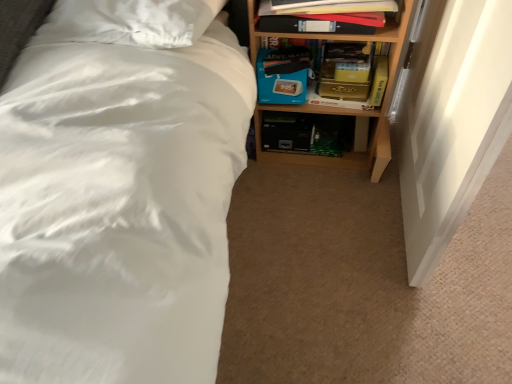
What is the approximate height of blue cardboard box at center?

blue cardboard box at center is 17.46 centimeters in height.

The height and width of the screenshot is (384, 512). Describe the element at coordinates (350, 109) in the screenshot. I see `wooden bookshelf at upper right` at that location.

Where is `matte black book at upper right, marked as the first book in a front-to-back arrangement`? This screenshot has height=384, width=512. matte black book at upper right, marked as the first book in a front-to-back arrangement is located at coordinates (322, 21).

What is the approximate height of matte black book at upper right, positioned as the second book in back-to-front order?

4.27 inches.

The height and width of the screenshot is (384, 512). What are the coordinates of `blue cardboard box at center` in the screenshot? It's located at (283, 75).

Is blue cardboard box at center further to camera compared to yellow matte paperback book at right?

Yes, blue cardboard box at center is behind yellow matte paperback book at right.

Is blue cardboard box at center facing towards yellow matte paperback book at right?

No, blue cardboard box at center is not aimed at yellow matte paperback book at right.

Is blue cardboard box at center surrounding yellow matte paperback book at right?

No.

Considering the sizes of objects blue cardboard box at center and yellow matte paperback book at right in the image provided, who is shorter, blue cardboard box at center or yellow matte paperback book at right?

yellow matte paperback book at right is shorter.

Considering the relative sizes of blue cardboard box at center and matte black book at upper right, positioned as the second book in back-to-front order, in the image provided, is blue cardboard box at center smaller than matte black book at upper right, positioned as the second book in back-to-front order,?

Indeed, blue cardboard box at center has a smaller size compared to matte black book at upper right, positioned as the second book in back-to-front order.

Can you confirm if blue cardboard box at center is taller than matte black book at upper right, positioned as the second book in back-to-front order?

Yes.

Is blue cardboard box at center spatially inside matte black book at upper right, marked as the first book in a front-to-back arrangement, or outside of it?

The correct answer is: outside.

From a real-world perspective, is yellow matte paperback book at right beneath wooden bookshelf at upper right?

Incorrect, from a real-world perspective, yellow matte paperback book at right is higher than wooden bookshelf at upper right.

In terms of height, does yellow matte paperback book at right look taller or shorter compared to wooden bookshelf at upper right?

Clearly, yellow matte paperback book at right is shorter compared to wooden bookshelf at upper right.

Is yellow matte paperback book at right facing away from wooden bookshelf at upper right?

Absolutely, yellow matte paperback book at right is directed away from wooden bookshelf at upper right.

Between yellow matte paperback book at right and wooden bookshelf at upper right, which one is positioned in front?

wooden bookshelf at upper right is closer to the camera.

Which is correct: matte black book at upper right, which is the first book from back to front, is inside matte black book at upper right, marked as the first book in a front-to-back arrangement, or outside of it?

matte black book at upper right, which is the first book from back to front, is spatially situated outside matte black book at upper right, marked as the first book in a front-to-back arrangement.

Where is `book above the matte black book at upper right, the 2th book viewed from the front (from the image's perspective)`? book above the matte black book at upper right, the 2th book viewed from the front (from the image's perspective) is located at coordinates (322, 21).

Is point (284, 102) more distant than point (261, 20)?

Yes.

Relative to matte black book at upper right, marked as the first book in a front-to-back arrangement, is matte black book at upper right, which is the first book from back to front, in front or behind?

matte black book at upper right, which is the first book from back to front, is positioned farther from the viewer than matte black book at upper right, marked as the first book in a front-to-back arrangement.

Which object is closer to the camera, wooden bookshelf at upper right or matte black book at upper right, which is the first book from back to front?

Positioned in front is wooden bookshelf at upper right.

From the image's perspective, starting from the wooden bookshelf at upper right, which book is the 1st one above? Please provide its 2D coordinates.

[(349, 85)]

Who is smaller, wooden bookshelf at upper right or matte black book at upper right, the 2th book viewed from the front?

With smaller size is matte black book at upper right, the 2th book viewed from the front.

Is wooden bookshelf at upper right wider or thinner than matte black book at upper right, the 2th book viewed from the front?

In the image, wooden bookshelf at upper right appears to be wider than matte black book at upper right, the 2th book viewed from the front.

Does yellow matte paperback book at right turn towards blue cardboard box at center?

No, yellow matte paperback book at right does not turn towards blue cardboard box at center.

Would you say yellow matte paperback book at right is a long distance from blue cardboard box at center?

No, yellow matte paperback book at right is in close proximity to blue cardboard box at center.

Is point (377, 79) in front of point (302, 57)?

No.

From the picture: Between yellow matte paperback book at right and blue cardboard box at center, which one has larger size?

blue cardboard box at center is bigger.

From the image's perspective, is blue cardboard box at center beneath matte black book at upper right, which is the first book from back to front?

Correct, blue cardboard box at center appears lower than matte black book at upper right, which is the first book from back to front, in the image.

Which object is wider, blue cardboard box at center or matte black book at upper right, the 2th book viewed from the front?

With larger width is blue cardboard box at center.

How much distance is there between blue cardboard box at center and matte black book at upper right, the 2th book viewed from the front?

A distance of 3.20 inches exists between blue cardboard box at center and matte black book at upper right, the 2th book viewed from the front.

Based on their sizes in the image, would you say blue cardboard box at center is bigger or smaller than matte black book at upper right, which is the first book from back to front?

In the image, blue cardboard box at center appears to be smaller than matte black book at upper right, which is the first book from back to front.

The height and width of the screenshot is (384, 512). I want to click on paperback book located in front of the blue cardboard box at center, so pyautogui.click(x=379, y=81).

The height and width of the screenshot is (384, 512). I want to click on box below the matte black book at upper right, positioned as the second book in back-to-front order (from a real-world perspective), so click(x=283, y=75).

Estimate the real-world distances between objects in this image. Which object is further from yellow matte paperback book at right, matte black book at upper right, which is the first book from back to front, or blue cardboard box at center?

Based on the image, blue cardboard box at center appears to be further to yellow matte paperback book at right.

Looking at the image, which one is located closer to yellow matte paperback book at right, matte black book at upper right, marked as the first book in a front-to-back arrangement, or matte black book at upper right, the 2th book viewed from the front?

Among the two, matte black book at upper right, the 2th book viewed from the front, is located nearer to yellow matte paperback book at right.

Looking at the image, which one is located further to matte black book at upper right, positioned as the second book in back-to-front order, matte black book at upper right, which is the first book from back to front, or blue cardboard box at center?

Based on the image, matte black book at upper right, which is the first book from back to front, appears to be further to matte black book at upper right, positioned as the second book in back-to-front order.

Estimate the real-world distances between objects in this image. Which object is closer to blue cardboard box at center, yellow matte paperback book at right or wooden bookshelf at upper right?

wooden bookshelf at upper right is positioned closer to the anchor blue cardboard box at center.

When comparing their distances from wooden bookshelf at upper right, does blue cardboard box at center or matte black book at upper right, positioned as the second book in back-to-front order, seem further?

matte black book at upper right, positioned as the second book in back-to-front order, is positioned further to the anchor wooden bookshelf at upper right.

When comparing their distances from blue cardboard box at center, does yellow matte paperback book at right or matte black book at upper right, positioned as the second book in back-to-front order, seem further?

The object further to blue cardboard box at center is yellow matte paperback book at right.

From the picture: Based on their spatial positions, is matte black book at upper right, positioned as the second book in back-to-front order, or blue cardboard box at center further from yellow matte paperback book at right?

The object further to yellow matte paperback book at right is blue cardboard box at center.

When comparing their distances from blue cardboard box at center, does wooden bookshelf at upper right or yellow matte paperback book at right seem further?

Among the two, yellow matte paperback book at right is located further to blue cardboard box at center.

The height and width of the screenshot is (384, 512). I want to click on book located between wooden bookshelf at upper right and blue cardboard box at center in the depth direction, so click(x=349, y=85).

Find the location of a particular element. shelf positioned between matte black book at upper right, positioned as the second book in back-to-front order, and yellow matte paperback book at right from near to far is located at coordinates (350, 109).

Find the location of a particular element. book between wooden bookshelf at upper right and yellow matte paperback book at right from front to back is located at coordinates (349, 85).

Identify the location of shelf between matte black book at upper right, marked as the first book in a front-to-back arrangement, and matte black book at upper right, which is the first book from back to front, along the z-axis. The height and width of the screenshot is (384, 512). click(350, 109).